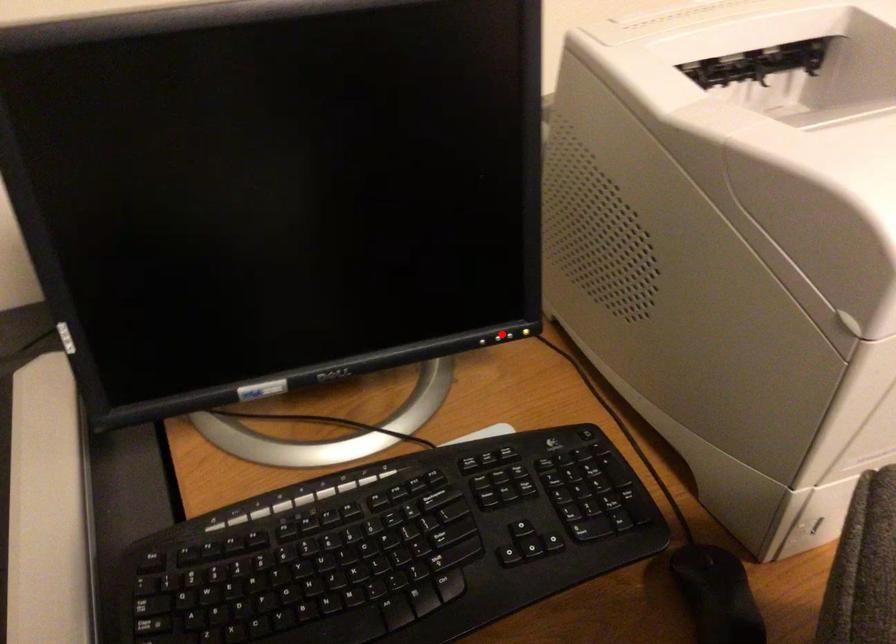
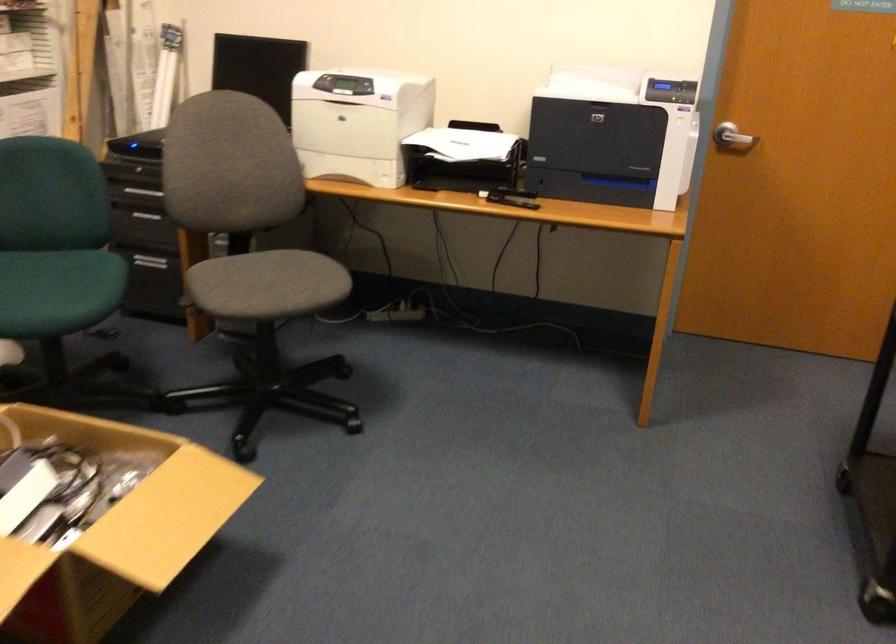
Question: I am providing you with two images of the same scene from different viewpoints. A red point is marked on the first image. At the location where the point appears in image 1, is it still visible in image 2?

Choices:
 (A) Yes
 (B) No

Answer: (B)